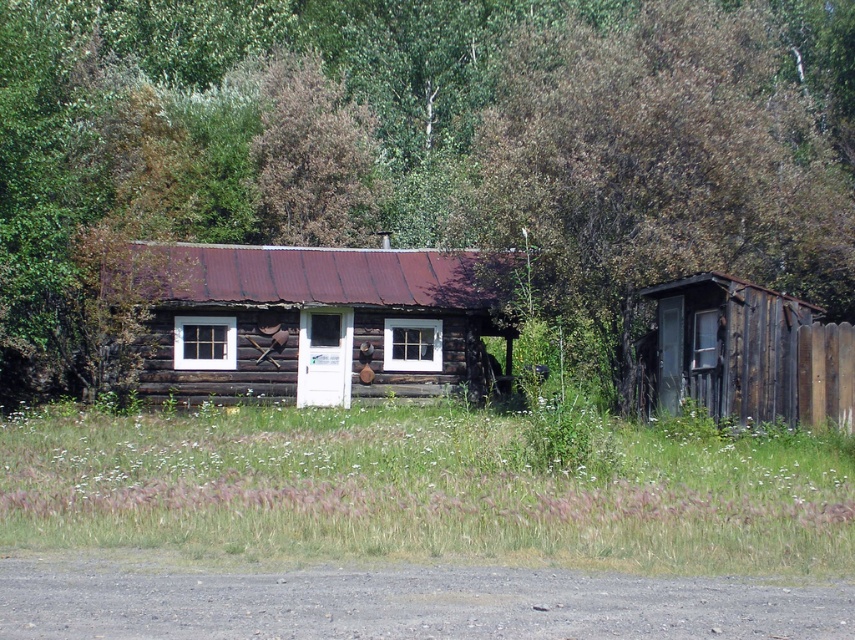
Question: Which object is the closest to the weathered wood cabin at center?

Choices:
 (A) brown wood log cabin at center
 (B) brown wood fence at right
 (C) weathered wood shed at right
 (D) brown wood tree at upper center

Answer: (A)

Question: Based on their relative distances, which object is nearer to the brown wood log cabin at center?

Choices:
 (A) weathered wood shed at right
 (B) brown wood fence at right
 (C) brown wood tree at upper center
 (D) weathered wood cabin at center

Answer: (B)

Question: Does weathered wood shed at right appear under brown wood tree at upper center?

Choices:
 (A) no
 (B) yes

Answer: (B)

Question: Does brown wood fence at right have a greater width compared to weathered wood shed at right?

Choices:
 (A) no
 (B) yes

Answer: (B)

Question: Which of the following is the closest to the observer?

Choices:
 (A) (310, 38)
 (B) (287, 195)

Answer: (B)

Question: Can you confirm if brown wood log cabin at center is smaller than weathered wood cabin at center?

Choices:
 (A) yes
 (B) no

Answer: (B)